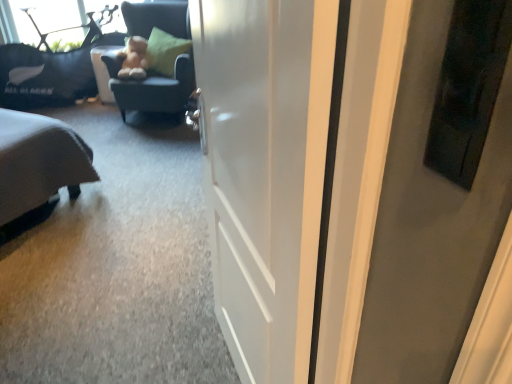
The height and width of the screenshot is (384, 512). Describe the element at coordinates (265, 171) in the screenshot. I see `white glossy door at center` at that location.

Where is `dark blue fabric chair at upper left`? This screenshot has width=512, height=384. dark blue fabric chair at upper left is located at coordinates (153, 93).

This screenshot has height=384, width=512. I want to click on white glossy door at center, so click(265, 171).

Between dark blue fabric chair at upper left and black fabric couch at upper left, which one appears on the left side from the viewer's perspective?

black fabric couch at upper left.

Is dark blue fabric chair at upper left positioned far away from black fabric couch at upper left?

Actually, dark blue fabric chair at upper left and black fabric couch at upper left are a little close together.

Does dark blue fabric chair at upper left have a lesser width compared to black fabric couch at upper left?

No, dark blue fabric chair at upper left is not thinner than black fabric couch at upper left.

What's the angular difference between dark blue fabric chair at upper left and black fabric couch at upper left's facing directions?

The angular difference between dark blue fabric chair at upper left and black fabric couch at upper left is 36.4 degrees.

Which of these two, black fabric couch at upper left or dark blue fabric chair at upper left, is smaller?

black fabric couch at upper left.

Can you confirm if black fabric couch at upper left is thinner than dark blue fabric chair at upper left?

Correct, the width of black fabric couch at upper left is less than that of dark blue fabric chair at upper left.

Is point (47, 34) more distant than point (188, 85)?

Yes, point (47, 34) is farther from viewer.

From a real-world perspective, is black fabric couch at upper left positioned over dark blue fabric chair at upper left based on gravity?

No, from a real-world perspective, black fabric couch at upper left is not over dark blue fabric chair at upper left

This screenshot has width=512, height=384. Find the location of `door that appears on the right of black fabric couch at upper left`. door that appears on the right of black fabric couch at upper left is located at coordinates (265, 171).

Considering the relative sizes of white glossy door at center and black fabric couch at upper left in the image provided, is white glossy door at center thinner than black fabric couch at upper left?

Correct, the width of white glossy door at center is less than that of black fabric couch at upper left.

Which object is further away from the camera, white glossy door at center or black fabric couch at upper left?

black fabric couch at upper left is more distant.

Is white glossy door at center located outside black fabric couch at upper left?

Indeed, white glossy door at center is completely outside black fabric couch at upper left.

Is dark blue fabric chair at upper left far from fuzzy brown teddy bear at upper center?

No, dark blue fabric chair at upper left is not far away from fuzzy brown teddy bear at upper center.

I want to click on teddy that is above the dark blue fabric chair at upper left (from the image's perspective), so click(x=133, y=58).

Considering the sizes of objects dark blue fabric chair at upper left and fuzzy brown teddy bear at upper center in the image provided, who is bigger, dark blue fabric chair at upper left or fuzzy brown teddy bear at upper center?

dark blue fabric chair at upper left.

From a real-world perspective, which is physically below, dark blue fabric chair at upper left or fuzzy brown teddy bear at upper center?

dark blue fabric chair at upper left is physically lower.

Does point (11, 107) appear closer or farther from the camera than point (249, 360)?

Point (11, 107) is positioned farther from the camera compared to point (249, 360).

Would you consider black fabric couch at upper left to be distant from white glossy door at center?

Yes, black fabric couch at upper left is far from white glossy door at center.

Between black fabric couch at upper left and white glossy door at center, which one is positioned behind?

black fabric couch at upper left is further away from the camera.

What's the angular difference between white glossy door at center and dark blue fabric chair at upper left's facing directions?

The angle between the facing direction of white glossy door at center and the facing direction of dark blue fabric chair at upper left is 61.5 degrees.

Considering the points (231, 167) and (189, 64), which point is in front, point (231, 167) or point (189, 64)?

The point (231, 167) is in front.

You are a GUI agent. You are given a task and a screenshot of the screen. Output one action in this format:
    pyautogui.click(x=<x>, y=<y>)
    Task: Click on the chair that is above the white glossy door at center (from the image's perspective)
    The image size is (512, 384).
    Given the screenshot: What is the action you would take?
    pyautogui.click(x=153, y=93)

From the image's perspective, does white glossy door at center appear higher than dark blue fabric chair at upper left?

No, from the image's perspective, white glossy door at center is not above dark blue fabric chair at upper left.

Relative to fuzzy brown teddy bear at upper center, is black fabric couch at upper left in front or behind?

black fabric couch at upper left is behind fuzzy brown teddy bear at upper center.

Is black fabric couch at upper left taller than fuzzy brown teddy bear at upper center?

Correct, black fabric couch at upper left is much taller as fuzzy brown teddy bear at upper center.

Which object is positioned more to the right, black fabric couch at upper left or fuzzy brown teddy bear at upper center?

fuzzy brown teddy bear at upper center is more to the right.

Find the location of a particular element. The image size is (512, 384). furniture above the fuzzy brown teddy bear at upper center (from the image's perspective) is located at coordinates (50, 70).

You are a GUI agent. You are given a task and a screenshot of the screen. Output one action in this format:
    pyautogui.click(x=<x>, y=<y>)
    Task: Click on the chair on the right of black fabric couch at upper left
    
    Given the screenshot: What is the action you would take?
    pyautogui.click(x=153, y=93)

Where is `chair in front of the black fabric couch at upper left`? The image size is (512, 384). chair in front of the black fabric couch at upper left is located at coordinates (153, 93).

Estimate the real-world distances between objects in this image. Which object is closer to dark blue fabric chair at upper left, black fabric couch at upper left or white glossy door at center?

The object closer to dark blue fabric chair at upper left is black fabric couch at upper left.

Considering their positions, is white glossy door at center positioned further to fuzzy brown teddy bear at upper center than dark blue fabric chair at upper left?

white glossy door at center.

When comparing their distances from white glossy door at center, does black fabric couch at upper left or dark blue fabric chair at upper left seem further?

Based on the image, black fabric couch at upper left appears to be further to white glossy door at center.

Which object lies nearer to the anchor point white glossy door at center, fuzzy brown teddy bear at upper center or dark blue fabric chair at upper left?

dark blue fabric chair at upper left.

Which object lies further to the anchor point black fabric couch at upper left, fuzzy brown teddy bear at upper center or white glossy door at center?

The object further to black fabric couch at upper left is white glossy door at center.

From the image, which object appears to be nearer to black fabric couch at upper left, dark blue fabric chair at upper left or white glossy door at center?

dark blue fabric chair at upper left is positioned closer to the anchor black fabric couch at upper left.

When comparing their distances from black fabric couch at upper left, does white glossy door at center or fuzzy brown teddy bear at upper center seem closer?

Based on the image, fuzzy brown teddy bear at upper center appears to be nearer to black fabric couch at upper left.

Based on their spatial positions, is dark blue fabric chair at upper left or black fabric couch at upper left closer to white glossy door at center?

dark blue fabric chair at upper left is closer to white glossy door at center.

The width and height of the screenshot is (512, 384). I want to click on chair located between white glossy door at center and fuzzy brown teddy bear at upper center in the depth direction, so click(x=153, y=93).

This screenshot has width=512, height=384. I want to click on teddy between white glossy door at center and black fabric couch at upper left along the z-axis, so click(x=133, y=58).

Where is `chair between white glossy door at center and black fabric couch at upper left from front to back`? The image size is (512, 384). chair between white glossy door at center and black fabric couch at upper left from front to back is located at coordinates (153, 93).

This screenshot has width=512, height=384. I want to click on teddy situated between black fabric couch at upper left and dark blue fabric chair at upper left from left to right, so click(x=133, y=58).